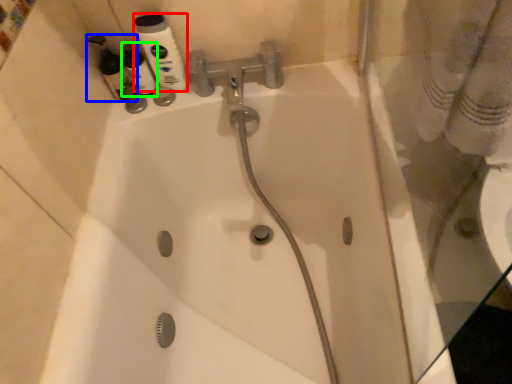
Question: Which object is positioned closest to mouthwash (highlighted by a red box)? Select from cleaning product (highlighted by a blue box) and cleaning product (highlighted by a green box).

Choices:
 (A) cleaning product
 (B) cleaning product

Answer: (B)